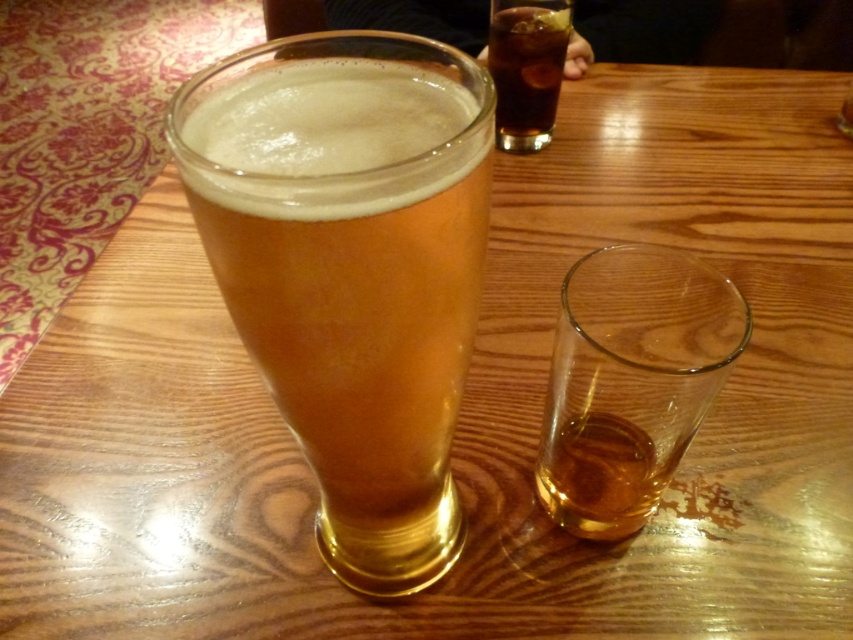
You are at a bar and want to order a drink. The bartender points to the golden glass at center and the dark brown glass at upper center. Which glass holds a beverage that is taller in height?

The golden glass at center is taller than the dark brown glass at upper center, so the beverage in the golden glass at center is taller in height.

Looking at this image, you are a bartender preparing a drink. You have a translucent glass at lower right and a dark brown glass at upper center. Which glass should you choose if you need a wider opening for adding ice cubes?

The translucent glass at lower right might be wider than dark brown glass at upper center, so it is more suitable for adding ice cubes due to its wider opening.

From the picture: You are at a bar and want to place a coaster between the golden glass at center and the dark brown glass at upper center. Can you fit the coaster between them if the coaster is 5 cm in diameter?

The golden glass at center might be wider than dark brown glass at upper center, so the distance between them is uncertain. Without knowing the exact spacing, it is hard to determine if the coaster will fit.